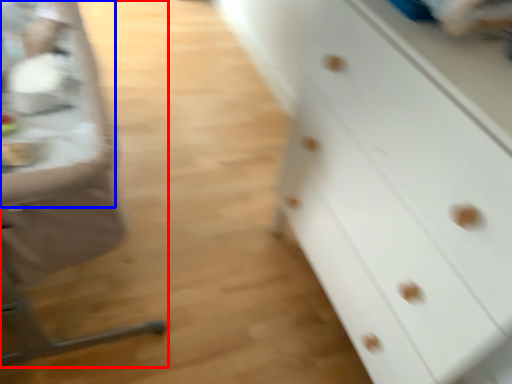
Question: Which point is closer to the camera, feeding chair (highlighted by a red box) or table (highlighted by a blue box)?

Choices:
 (A) feeding chair
 (B) table

Answer: (A)